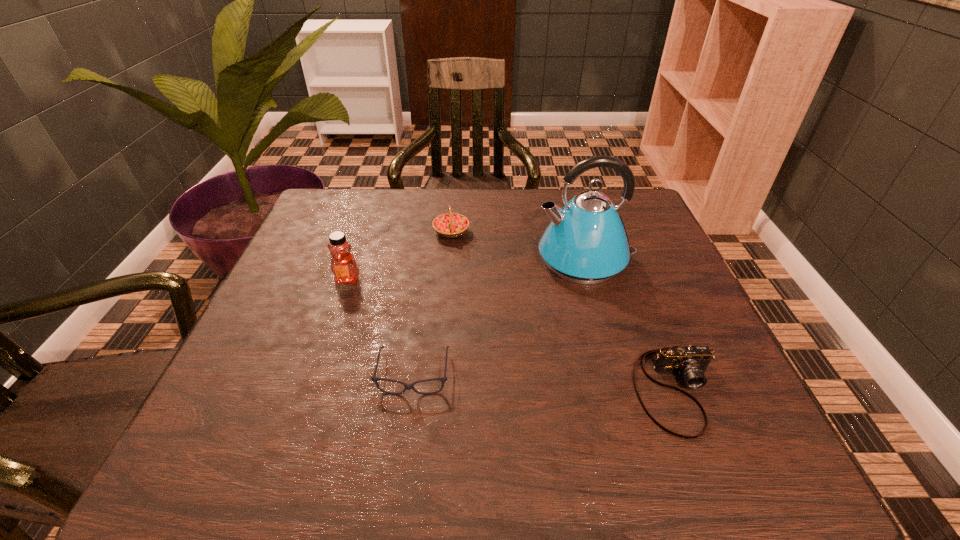
This screenshot has width=960, height=540. I want to click on vacant area at the far edge of the desktop, so (x=516, y=226).

Find the location of `vacant space at the left edge of the desktop`. vacant space at the left edge of the desktop is located at coordinates (285, 371).

What are the coordinates of `vacant space at the right edge of the desktop` in the screenshot? It's located at click(691, 294).

Image resolution: width=960 pixels, height=540 pixels. Identify the location of vacant space at the far left corner. (355, 237).

Find the location of a particular element. This screenshot has width=960, height=540. blank space at the far right corner is located at coordinates (635, 225).

What are the coordinates of `vacant space that is in between the strawberry and the honey` in the screenshot? It's located at (399, 256).

The width and height of the screenshot is (960, 540). Identify the location of empty location between the camera and the shortest object. (545, 383).

Where is `free space between the camera and the second tallest object`? free space between the camera and the second tallest object is located at coordinates (513, 335).

Find the location of a particular element. Image resolution: width=960 pixels, height=540 pixels. vacant area that lies between the second shortest object and the third tallest object is located at coordinates (564, 312).

Find the location of `vacant point located between the third tallest object and the leftmost object`. vacant point located between the third tallest object and the leftmost object is located at coordinates (399, 256).